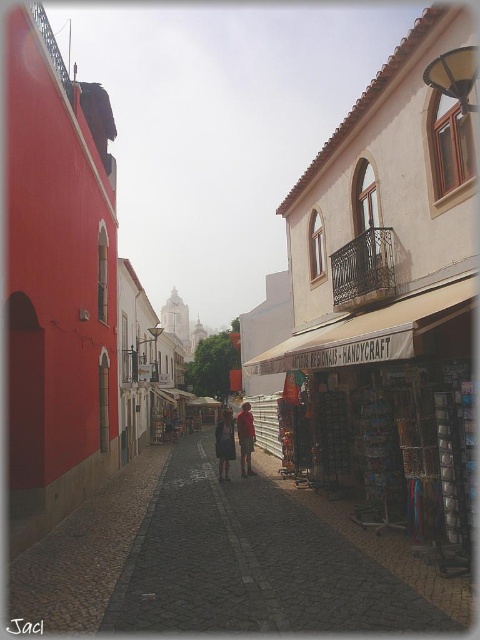
Question: Which object is farther from the camera taking this photo?

Choices:
 (A) matte red shirt at center
 (B) reddish-brown leather shoes at center
 (C) dark brown leather jacket at center
 (D) dark cobblestone alley at center

Answer: (A)

Question: Can you confirm if dark cobblestone alley at center is positioned to the left of dark brown leather jacket at center?

Choices:
 (A) yes
 (B) no

Answer: (A)

Question: Based on their relative distances, which object is farther from the dark cobblestone alley at center?

Choices:
 (A) reddish-brown leather shoes at center
 (B) dark brown leather jacket at center

Answer: (B)

Question: Which point is closer to the camera taking this photo?

Choices:
 (A) tap(146, 618)
 (B) tap(252, 451)

Answer: (A)

Question: Is reddish-brown leather shoes at center wider than dark brown leather jacket at center?

Choices:
 (A) yes
 (B) no

Answer: (A)

Question: Can you confirm if dark brown leather jacket at center is wider than matte red shirt at center?

Choices:
 (A) no
 (B) yes

Answer: (B)